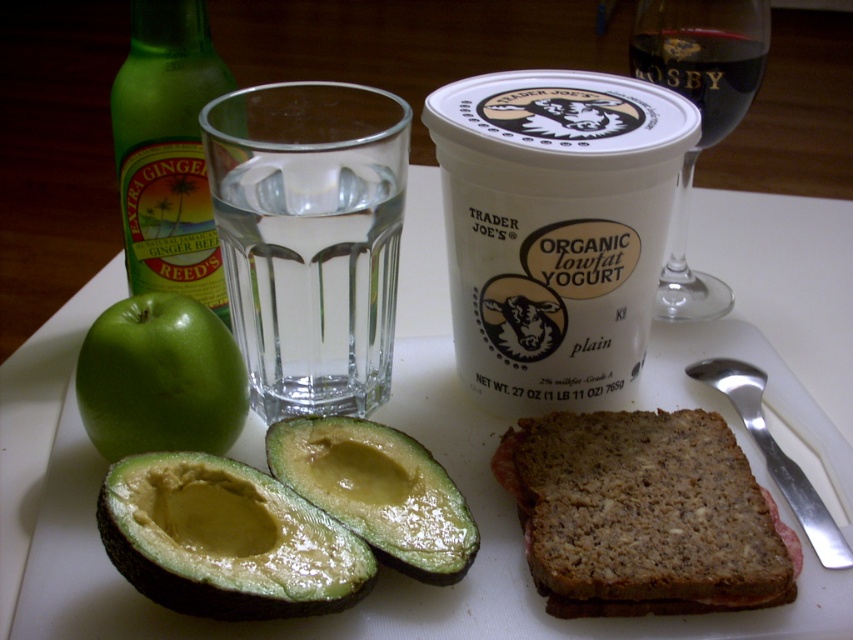
Is green matte apple at left wider than transparent glass wine at upper right?

In fact, green matte apple at left might be narrower than transparent glass wine at upper right.

How far apart are green matte apple at left and transparent glass wine at upper right?

The distance of green matte apple at left from transparent glass wine at upper right is 12.02 inches.

The image size is (853, 640). Describe the element at coordinates (160, 378) in the screenshot. I see `green matte apple at left` at that location.

The height and width of the screenshot is (640, 853). What are the coordinates of `green matte apple at left` in the screenshot? It's located at (160, 378).

Is green matte avocado at lower left smaller than green matte apple at left?

Actually, green matte avocado at lower left might be larger than green matte apple at left.

Which is behind, point (250, 512) or point (111, 452)?

The point (111, 452) is behind.

The image size is (853, 640). What do you see at coordinates (225, 540) in the screenshot?
I see `green matte avocado at lower left` at bounding box center [225, 540].

This screenshot has height=640, width=853. What are the coordinates of `green matte avocado at lower left` in the screenshot? It's located at (225, 540).

Does green glass bottle at upper left appear on the right side of dark red glass at upper right?

No, green glass bottle at upper left is not to the right of dark red glass at upper right.

Which is above, green glass bottle at upper left or dark red glass at upper right?

dark red glass at upper right is higher up.

Is point (202, 38) farther from camera compared to point (727, 88)?

No, (202, 38) is in front of (727, 88).

Find the location of a particular element. This screenshot has width=853, height=640. green glass bottle at upper left is located at coordinates (167, 150).